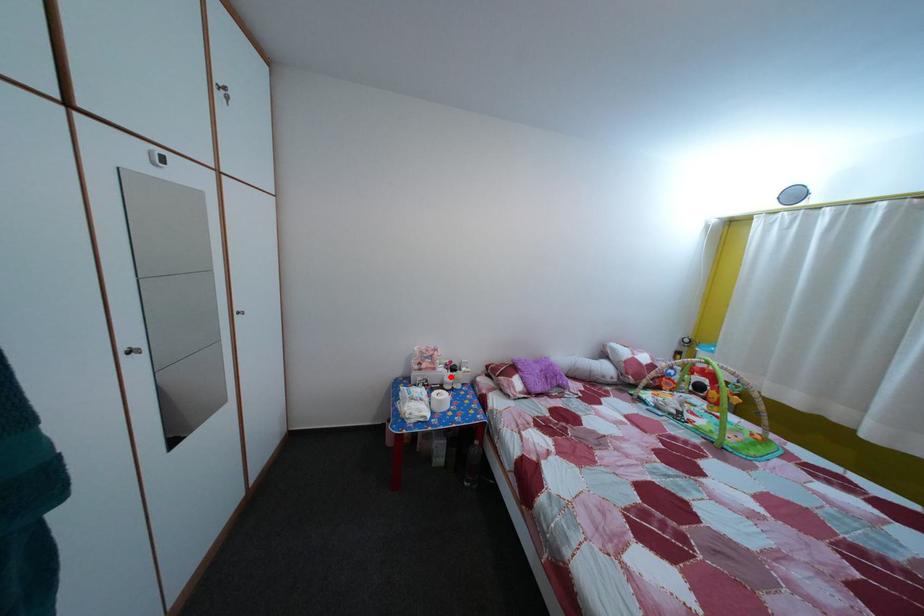
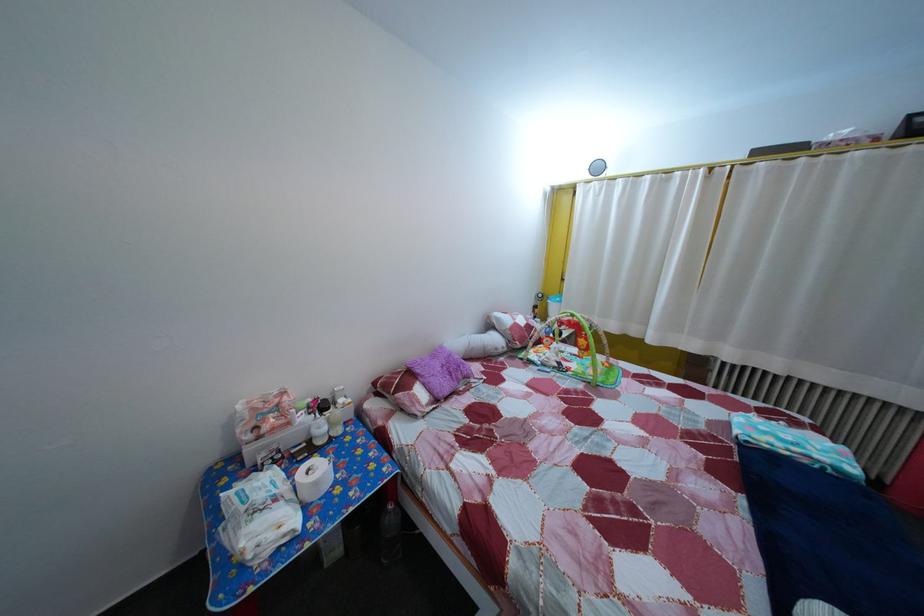
Locate, in the second image, the point that corresponds to the highlighted location in the first image.

(311, 427)